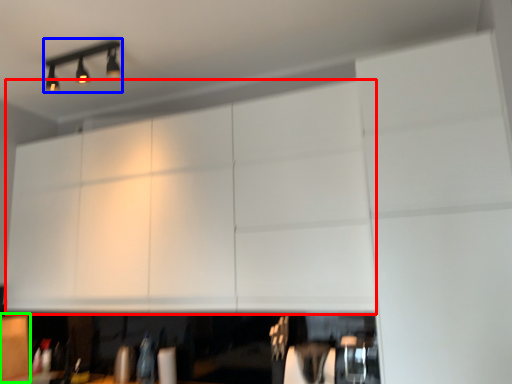
Question: Estimate the real-world distances between objects in this image. Which object is closer to cabinetry (highlighted by a red box), lamp (highlighted by a blue box) or cabinetry (highlighted by a green box)?

Choices:
 (A) lamp
 (B) cabinetry

Answer: (A)